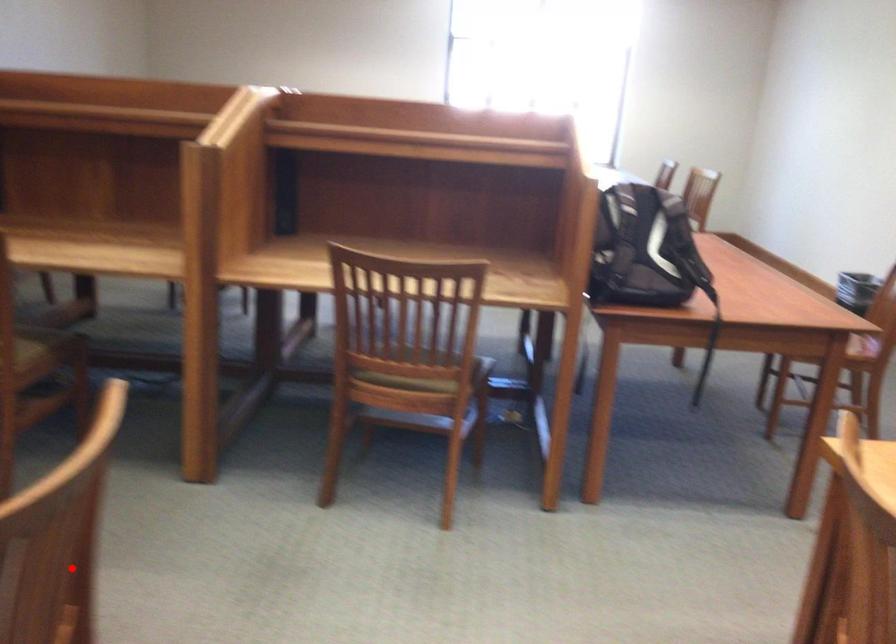
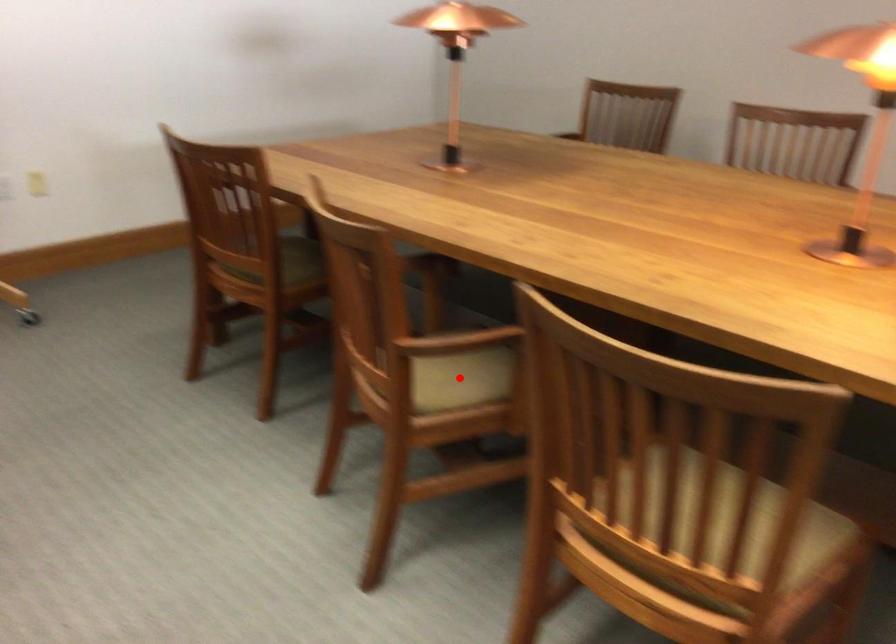
I am providing you with two images of the same scene from different viewpoints. A red point is marked on the first image and another point is marked on the second image. Is the red point in image1 aligned with the point shown in image2?

No